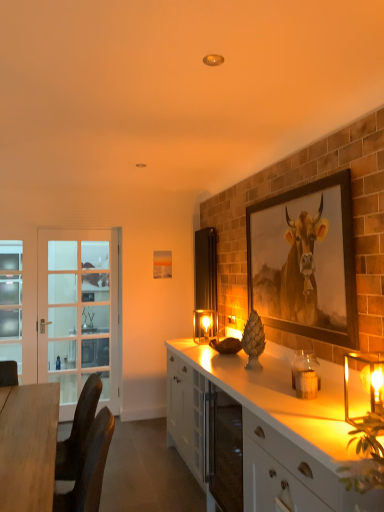
Measure the distance between wooden framed cow portrait at upper right and camera.

The depth of wooden framed cow portrait at upper right is 2.18 meters.

What is the approximate height of translucent glass candle holder at right, the 1th candle holder positioned from the right?

It is 11.17 inches.

You are a GUI agent. You are given a task and a screenshot of the screen. Output one action in this format:
    pyautogui.click(x=<x>, y=<y>)
    Task: Click on the light blue frosted glass screen door at left, which appears as the 2th screen door when viewed from the right
    The height and width of the screenshot is (512, 384).
    Given the screenshot: What is the action you would take?
    pyautogui.click(x=12, y=304)

Identify the location of white glossy cabinet at lower right, the first cabinetry from the front. (292, 475).

Where is `white glass screen door at left, placed as the 2th screen door when sorted from left to right`? This screenshot has height=512, width=384. white glass screen door at left, placed as the 2th screen door when sorted from left to right is located at coordinates (78, 313).

Could you tell me if translucent glass candle at right, acting as the 2th candle holder starting from the front, is facing light blue frosted glass screen door at left, which appears as the 2th screen door when viewed from the right?

No, translucent glass candle at right, acting as the 2th candle holder starting from the front, is not facing towards light blue frosted glass screen door at left, which appears as the 2th screen door when viewed from the right.

Consider the image. From the image's perspective, would you say translucent glass candle at right, acting as the 2th candle holder starting from the front, is positioned over light blue frosted glass screen door at left, positioned as the first screen door in left-to-right order?

No, from the image's perspective, translucent glass candle at right, acting as the 2th candle holder starting from the front, is not above light blue frosted glass screen door at left, positioned as the first screen door in left-to-right order.

From a real-world perspective, who is located higher, translucent glass candle at right, which is counted as the 2th candle holder, starting from the right, or light blue frosted glass screen door at left, positioned as the first screen door in left-to-right order?

From a 3D spatial view, light blue frosted glass screen door at left, positioned as the first screen door in left-to-right order, is above.

Which object is thinner, translucent glass candle at right, the 2th candle holder in the back-to-front sequence, or light blue frosted glass screen door at left, which appears as the 2th screen door when viewed from the right?

light blue frosted glass screen door at left, which appears as the 2th screen door when viewed from the right.

Could you tell me if translucent glass candle at right, the 2th candle holder in the back-to-front sequence, is facing wooden framed cow portrait at upper right?

No, translucent glass candle at right, the 2th candle holder in the back-to-front sequence, is not oriented towards wooden framed cow portrait at upper right.

From the image's perspective, would you say translucent glass candle at right, which is counted as the 2th candle holder, starting from the right, is shown under wooden framed cow portrait at upper right?

Yes.

Between translucent glass candle at right, acting as the 2th candle holder starting from the front, and wooden framed cow portrait at upper right, which one appears on the left side from the viewer's perspective?

translucent glass candle at right, acting as the 2th candle holder starting from the front, is more to the left.

Between white glossy cabinet at center, positioned as the first cabinetry in back-to-front order, and matte glass candle holder at center, the 1th candle holder when ordered from back to front, which one is positioned in front?

white glossy cabinet at center, positioned as the first cabinetry in back-to-front order, is closer to the camera.

From the image's perspective, which one is positioned higher, white glossy cabinet at center, positioned as the first cabinetry in back-to-front order, or matte glass candle holder at center, the 1th candle holder when ordered from back to front?

matte glass candle holder at center, the 1th candle holder when ordered from back to front.

Looking at this image, does white glossy cabinet at center, positioned as the first cabinetry in back-to-front order, turn towards matte glass candle holder at center, which is the first candle holder in left-to-right order?

No, white glossy cabinet at center, positioned as the first cabinetry in back-to-front order, is not aimed at matte glass candle holder at center, which is the first candle holder in left-to-right order.

Which is behind, point (181, 385) or point (195, 313)?

The point (195, 313) is behind.

Consider the image. Is white glossy cabinet at center, the 2th cabinetry from the front, looking in the opposite direction of wooden desk at left?

No, white glossy cabinet at center, the 2th cabinetry from the front, is not facing the opposite direction of wooden desk at left.

In the scene shown: How many degrees apart are the facing directions of white glossy cabinet at center, the 2th cabinetry from the front, and wooden desk at left?

There is a 90.1-degree angle between the facing directions of white glossy cabinet at center, the 2th cabinetry from the front, and wooden desk at left.

In the scene shown: Is white glossy cabinet at center, the 2th cabinetry from the front, not within wooden desk at left?

white glossy cabinet at center, the 2th cabinetry from the front, lies outside wooden desk at left's area.

Is point (193, 395) closer to viewer compared to point (38, 401)?

No, it is behind (38, 401).

Could you tell me if translucent glass candle at right, which is counted as the 2th candle holder, starting from the right, is turned towards wooden desk at left?

No, translucent glass candle at right, which is counted as the 2th candle holder, starting from the right, is not aimed at wooden desk at left.

Based on the photo, is translucent glass candle at right, arranged as the 2th candle holder when viewed from the left, positioned before wooden desk at left?

No, it is not.

Which is farther, (14, 288) or (197, 326)?

The point (14, 288) is behind.

Is light blue frosted glass screen door at left, positioned as the first screen door in left-to-right order, not within matte glass candle holder at center, which is counted as the third candle holder, starting from the right?

Yes, light blue frosted glass screen door at left, positioned as the first screen door in left-to-right order, is outside of matte glass candle holder at center, which is counted as the third candle holder, starting from the right.

Would you say light blue frosted glass screen door at left, which appears as the 2th screen door when viewed from the right, is to the left or to the right of matte glass candle holder at center, which is the first candle holder in left-to-right order, in the picture?

Clearly, light blue frosted glass screen door at left, which appears as the 2th screen door when viewed from the right, is on the left of matte glass candle holder at center, which is the first candle holder in left-to-right order, in the image.

What's the angular difference between light blue frosted glass screen door at left, which appears as the 2th screen door when viewed from the right, and matte glass candle holder at center, the 1th candle holder when ordered from back to front,'s facing directions?

They differ by 89.6 degrees in their facing directions.

From the image's perspective, is light blue frosted glass screen door at left, positioned as the first screen door in left-to-right order, positioned above or below wooden desk at left?

light blue frosted glass screen door at left, positioned as the first screen door in left-to-right order, is situated higher than wooden desk at left in the image.

Can you confirm if light blue frosted glass screen door at left, which appears as the 2th screen door when viewed from the right, is shorter than wooden desk at left?

Incorrect, the height of light blue frosted glass screen door at left, which appears as the 2th screen door when viewed from the right, does not fall short of that of wooden desk at left.

Consider the image. Is light blue frosted glass screen door at left, positioned as the first screen door in left-to-right order, far from wooden desk at left?

Yes, light blue frosted glass screen door at left, positioned as the first screen door in left-to-right order, and wooden desk at left are located far from each other.

This screenshot has height=512, width=384. I want to click on screen door above the translucent glass candle at right, acting as the 2th candle holder starting from the front (from the image's perspective), so click(x=12, y=304).

From a real-world perspective, starting from the wooden framed cow portrait at upper right, which candle holder is the 3rd one below it? Please provide its 2D coordinates.

[(305, 372)]

Looking at the image, which one is located closer to translucent glass candle holder at right, the third candle holder in the left-to-right sequence, white glossy cabinet at center, the 2th cabinetry from the front, or white glossy cabinet at lower right, the second cabinetry when ordered from back to front?

white glossy cabinet at lower right, the second cabinetry when ordered from back to front, is closer to translucent glass candle holder at right, the third candle holder in the left-to-right sequence.

Based on their spatial positions, is white glossy cabinet at lower right, the second cabinetry when ordered from back to front, or wooden desk at left closer to white glossy cabinet at center, the 2th cabinetry from the front?

white glossy cabinet at lower right, the second cabinetry when ordered from back to front, is positioned closer to the anchor white glossy cabinet at center, the 2th cabinetry from the front.

Considering their positions, is wooden framed cow portrait at upper right positioned closer to wooden desk at left than light blue frosted glass screen door at left, positioned as the first screen door in left-to-right order?

The object closer to wooden desk at left is wooden framed cow portrait at upper right.

Looking at the image, which one is located further to white glossy cabinet at center, positioned as the first cabinetry in back-to-front order, matte glass candle holder at center, which is counted as the third candle holder, starting from the right, or wooden framed cow portrait at upper right?

wooden framed cow portrait at upper right.

Considering their positions, is matte glass candle holder at center, the 1th candle holder when ordered from back to front, positioned closer to light blue frosted glass screen door at left, which appears as the 2th screen door when viewed from the right, than white glossy cabinet at lower right, the second cabinetry when ordered from back to front?

matte glass candle holder at center, the 1th candle holder when ordered from back to front.

Which object lies further to the anchor point wooden desk at left, translucent glass candle at right, which is counted as the 2th candle holder, starting from the right, or matte glass candle holder at center, which is counted as the third candle holder, starting from the right?

matte glass candle holder at center, which is counted as the third candle holder, starting from the right.

From the image, which object appears to be farther from wooden framed cow portrait at upper right, white glossy cabinet at lower right, the second cabinetry when ordered from back to front, or wooden desk at left?

wooden desk at left is further to wooden framed cow portrait at upper right.

Estimate the real-world distances between objects in this image. Which object is further from wooden desk at left, translucent glass candle holder at right, the third candle holder in the left-to-right sequence, or translucent glass candle at right, arranged as the 2th candle holder when viewed from the left?

translucent glass candle holder at right, the third candle holder in the left-to-right sequence, lies further to wooden desk at left than the other object.

Locate an element on the screen. This screenshot has width=384, height=512. cabinetry between translucent glass candle at right, acting as the 2th candle holder starting from the front, and matte glass candle holder at center, which is counted as the third candle holder, starting from the right, along the z-axis is located at coordinates (206, 432).

Where is `picture frame between wooden desk at left and matte glass candle holder at center, which is the first candle holder in left-to-right order, from front to back`? Image resolution: width=384 pixels, height=512 pixels. picture frame between wooden desk at left and matte glass candle holder at center, which is the first candle holder in left-to-right order, from front to back is located at coordinates (306, 261).

Where is `picture frame between white glossy cabinet at lower right, the first cabinetry from the front, and matte glass candle holder at center, the 1th candle holder when ordered from back to front, in the front-back direction`? picture frame between white glossy cabinet at lower right, the first cabinetry from the front, and matte glass candle holder at center, the 1th candle holder when ordered from back to front, in the front-back direction is located at coordinates (306, 261).

Locate an element on the screen. picture frame located between white glossy cabinet at lower right, the second cabinetry when ordered from back to front, and light blue frosted glass screen door at left, positioned as the first screen door in left-to-right order, in the depth direction is located at coordinates (306, 261).